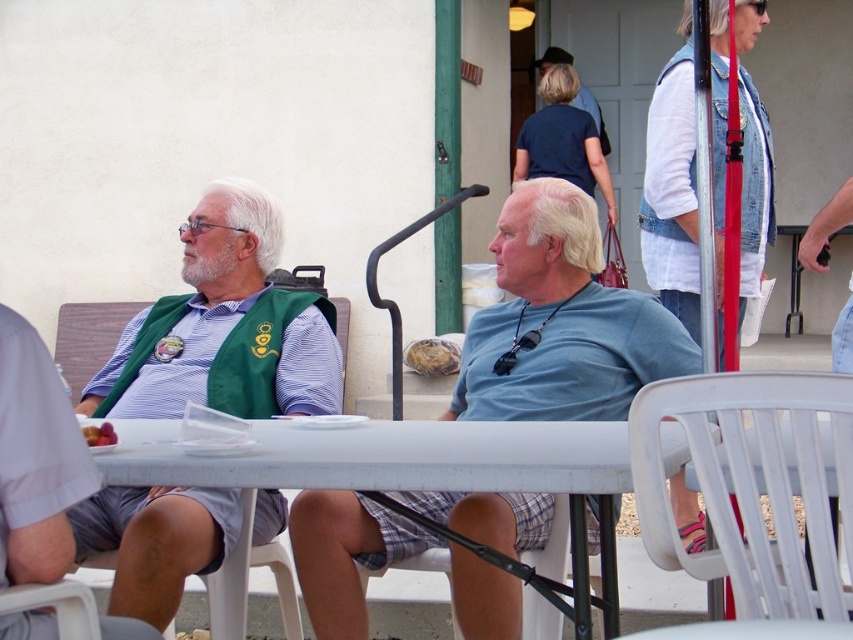
You are standing in front of the white plastic table at center and want to hand a document to the person wearing the green fabric vest at left. Which direction should you move to reach them?

The green fabric vest at left is to the left of the white plastic table at center, so you should move to your left to reach the person wearing the green fabric vest at left.

You are standing in front of the white plastic table and want to locate the green fabric vest at left. Where exactly is it located in terms of coordinates?

The green fabric vest at left is located at coordinates point (225, 326).

You are a photographer trying to capture a candid shot of both the blue cotton shirt at center and the green fabric vest at left. Since you want to ensure both are fully visible in the frame, which clothing item should you focus on first to adjust your camera angle?

The blue cotton shirt at center is not as tall as the green fabric vest at left, so you should focus on adjusting your camera angle to ensure the shorter blue cotton shirt at center is fully visible first before framing the taller green fabric vest at left.